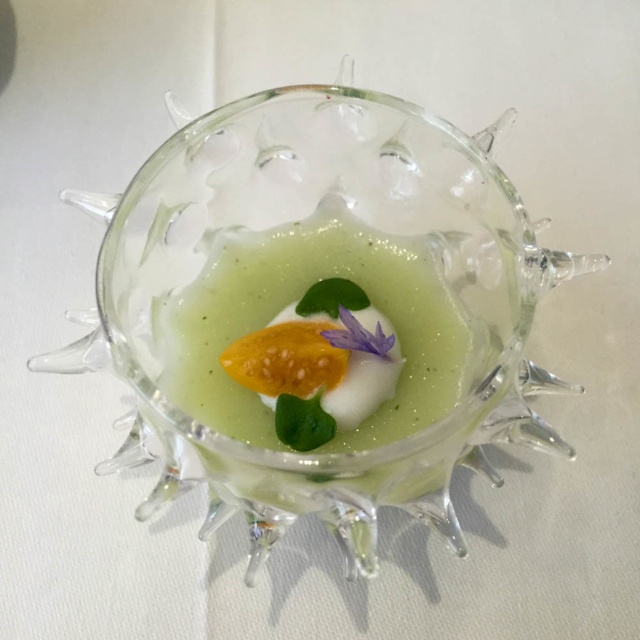
You are a food stylist arranging a dish. The scene shows a transparent glass bowl at center and a matte yellow fruit at center. Where should you place a new garnish so it is between the two items?

Place the garnish between the transparent glass bowl at center and the matte yellow fruit at center, ensuring it is to the left of the transparent glass bowl at center and to the right of the matte yellow fruit at center since the bowl is to the right of the fruit.

You are a chef holding a spoon that is 7 inches long. You want to taste the soup in the transparent glass bowl at center. Can you reach the soup with your spoon without moving the bowl?

The distance between the transparent glass bowl at center and the viewer is 6.85 inches, which is less than the spoon length of 7 inches. Therefore, the chef can reach the soup with the spoon.

You are a chef preparing a dish and need to ensure that the green gelatinous at center doesn not overflow when heated. Given that the transparent glass bowl at center is taller, will it provide enough space to prevent overflow?

The transparent glass bowl at center has a greater height than the green gelatinous at center, so it should provide sufficient space to prevent overflow when heated.